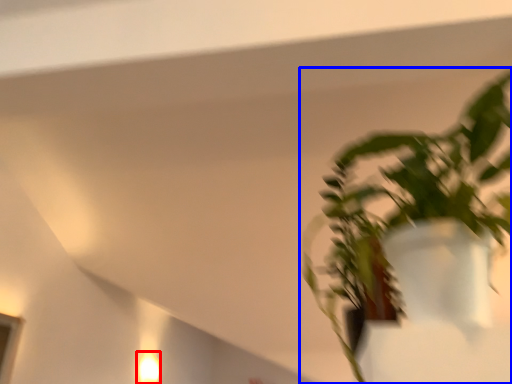
Question: Which object appears closest to the camera in this image, light fixture (highlighted by a red box) or houseplant (highlighted by a blue box)?

Choices:
 (A) light fixture
 (B) houseplant

Answer: (B)